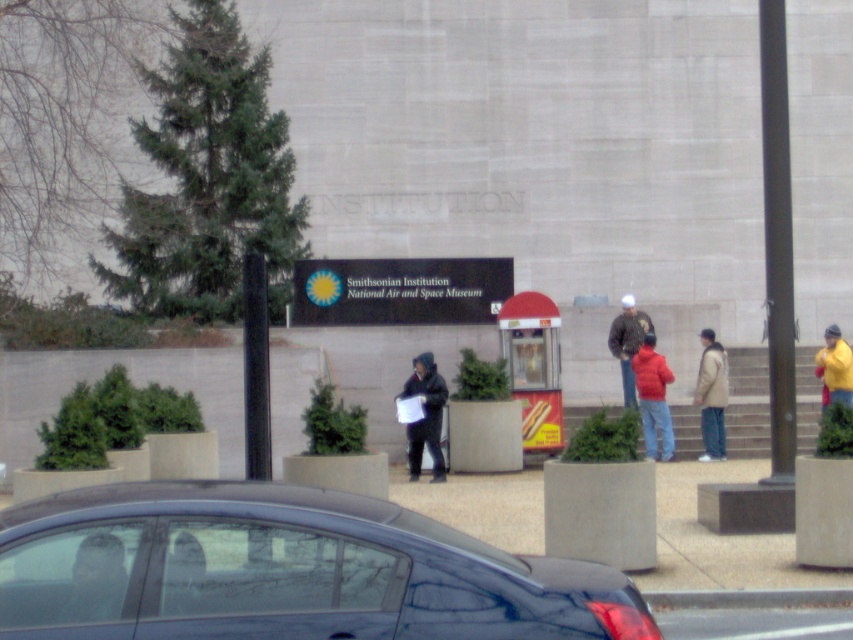
In the scene shown: You are a security guard at the museum and need to locate a visitor wearing a yellow matte jacket. You see the matte black jacket at center and the yellow matte jacket at upper right. Which one is larger in size?

The yellow matte jacket at upper right is larger in size because the matte black jacket at center occupies less space than it.

You are a photographer standing at the entrance of the Smithsonian National Air and Space Museum. You see a light brown leather jacket at lower left and a matte black jacket at center. Can you fit both jackets in your camera frame if the frame can only accommodate objects within a 10 inch width?

The light brown leather jacket at lower left and matte black jacket at center are 8.35 inches apart from each other. Since the distance between them is less than 10 inches, both jackets can fit within the camera frame.